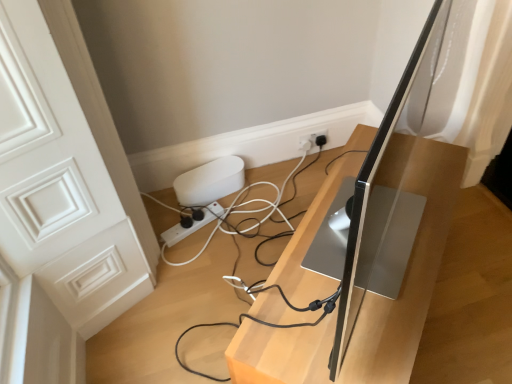
The image size is (512, 384). In order to click on white plastic power strip at lower center in this screenshot , I will do `click(192, 225)`.

What do you see at coordinates (408, 275) in the screenshot? This screenshot has width=512, height=384. I see `silver metallic monitor at center` at bounding box center [408, 275].

The image size is (512, 384). What are the coordinates of `silver metallic computer monitor at center` in the screenshot? It's located at (368, 198).

This screenshot has width=512, height=384. What are the coordinates of `white plastic power strip at lower center` in the screenshot? It's located at (192, 225).

Is silver metallic computer monitor at center further to camera compared to white plastic power strip at lower center?

No, silver metallic computer monitor at center is closer to the viewer.

Is silver metallic computer monitor at center completely or partially outside of white plastic power strip at lower center?

Yes, silver metallic computer monitor at center is located beyond the bounds of white plastic power strip at lower center.

From the picture: Could you measure the distance between silver metallic computer monitor at center and white plastic power strip at lower center?

silver metallic computer monitor at center is 34.39 inches from white plastic power strip at lower center.

From a real-world perspective, is silver metallic computer monitor at center beneath white plastic power strip at lower center?

No.

From the picture: Does silver metallic monitor at center have a smaller size compared to white plastic power strip at lower center?

No, silver metallic monitor at center is not smaller than white plastic power strip at lower center.

Is silver metallic monitor at center positioned with its back to white plastic power strip at lower center?

Yes.

Is silver metallic monitor at center completely or partially outside of white plastic power strip at lower center?

Indeed, silver metallic monitor at center is completely outside white plastic power strip at lower center.

From the image's perspective, is silver metallic monitor at center located above or below white plastic power strip at lower center?

silver metallic monitor at center is situated lower than white plastic power strip at lower center in the image.

Which object is closer to the camera, silver metallic monitor at center or silver metallic computer monitor at center?

silver metallic computer monitor at center is closer to the camera.

Is silver metallic monitor at center positioned with its back to silver metallic computer monitor at center?

No.

From a real-world perspective, who is located lower, silver metallic monitor at center or silver metallic computer monitor at center?

From a 3D spatial view, silver metallic monitor at center is below.

Looking at this image, which is farther from the camera, [307,220] or [347,277]?

The point [307,220] is farther from the camera.

From the image's perspective, is white plastic power strip at lower center below silver metallic computer monitor at center?

Indeed, from the image's perspective, white plastic power strip at lower center is shown beneath silver metallic computer monitor at center.

Looking at this image, is white plastic power strip at lower center far from silver metallic computer monitor at center?

white plastic power strip at lower center is actually quite close to silver metallic computer monitor at center.

Can we say white plastic power strip at lower center lies outside silver metallic computer monitor at center?

Absolutely, white plastic power strip at lower center is external to silver metallic computer monitor at center.

Is white plastic power strip at lower center beside silver metallic monitor at center?

white plastic power strip at lower center and silver metallic monitor at center are not in contact.

From the image's perspective, is white plastic power strip at lower center above or below silver metallic monitor at center?

Based on their image positions, white plastic power strip at lower center is located above silver metallic monitor at center.

How different are the orientations of white plastic power strip at lower center and silver metallic monitor at center in degrees?

23.5 degrees.

Considering the relative sizes of white plastic power strip at lower center and silver metallic monitor at center in the image provided, is white plastic power strip at lower center taller than silver metallic monitor at center?

Incorrect, the height of white plastic power strip at lower center is not larger of that of silver metallic monitor at center.

Is silver metallic computer monitor at center oriented towards silver metallic monitor at center?

No, silver metallic computer monitor at center does not turn towards silver metallic monitor at center.

In the scene shown: Considering the relative positions of silver metallic computer monitor at center and silver metallic monitor at center in the image provided, is silver metallic computer monitor at center to the left of silver metallic monitor at center from the viewer's perspective?

No.

Considering the points (393, 130) and (440, 213), which point is behind, point (393, 130) or point (440, 213)?

The point (440, 213) is farther.

At what (x,y) coordinates should I click in order to perform the action: click on extension cord located below the silver metallic computer monitor at center (from the image's perspective). Please return your answer as a coordinate pair (x, y). Image resolution: width=512 pixels, height=384 pixels. Looking at the image, I should click on (192, 225).

Where is `extension cord on the left of silver metallic monitor at center`? Image resolution: width=512 pixels, height=384 pixels. extension cord on the left of silver metallic monitor at center is located at coordinates (192, 225).

Based on their spatial positions, is white plastic power strip at lower center or silver metallic computer monitor at center closer to silver metallic monitor at center?

silver metallic computer monitor at center lies closer to silver metallic monitor at center than the other object.

When comparing their distances from silver metallic computer monitor at center, does white plastic power strip at lower center or silver metallic monitor at center seem further?

white plastic power strip at lower center lies further to silver metallic computer monitor at center than the other object.

When comparing their distances from white plastic power strip at lower center, does silver metallic computer monitor at center or silver metallic monitor at center seem further?

Among the two, silver metallic computer monitor at center is located further to white plastic power strip at lower center.

Looking at the image, which one is located closer to silver metallic computer monitor at center, silver metallic monitor at center or white plastic power strip at lower center?

Among the two, silver metallic monitor at center is located nearer to silver metallic computer monitor at center.

Which object lies nearer to the anchor point silver metallic monitor at center, silver metallic computer monitor at center or white plastic power strip at lower center?

silver metallic computer monitor at center is positioned closer to the anchor silver metallic monitor at center.

Considering their positions, is silver metallic monitor at center positioned closer to white plastic power strip at lower center than silver metallic computer monitor at center?

Based on the image, silver metallic monitor at center appears to be nearer to white plastic power strip at lower center.

Locate an element on the screen. Image resolution: width=512 pixels, height=384 pixels. furniture between silver metallic computer monitor at center and white plastic power strip at lower center from front to back is located at coordinates (408, 275).